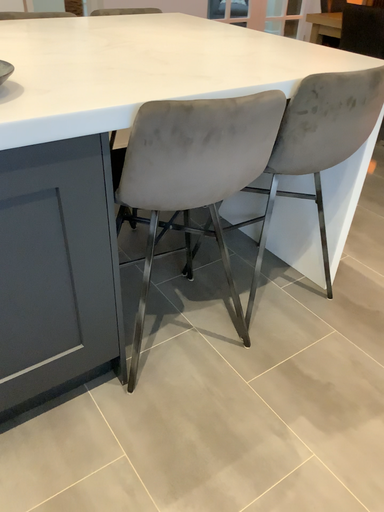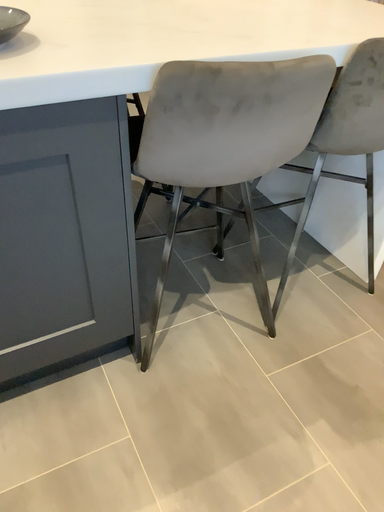
Question: How did the camera likely rotate when shooting the video?

Choices:
 (A) rotated right
 (B) rotated left

Answer: (B)